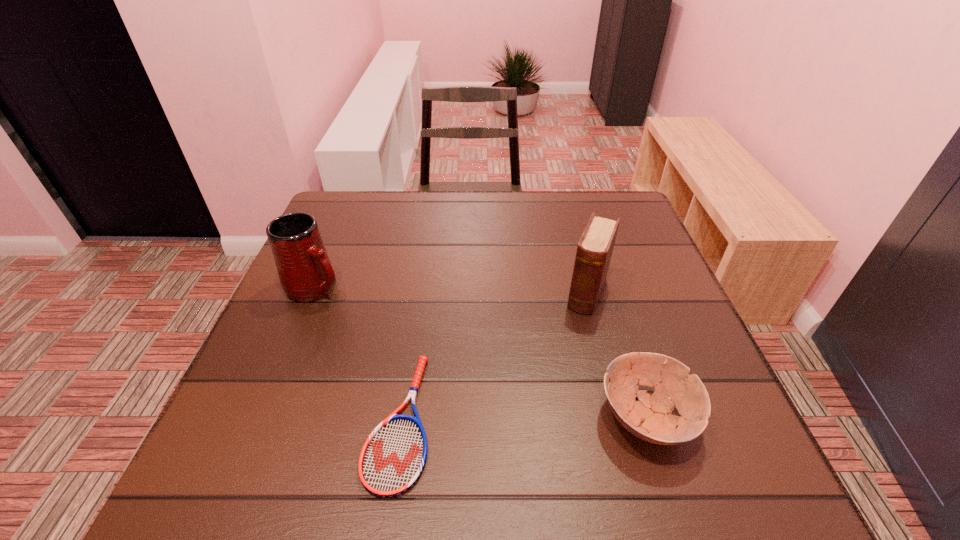
Image resolution: width=960 pixels, height=540 pixels. Find the location of `free space between the diary and the shortest object`. free space between the diary and the shortest object is located at coordinates (493, 357).

Image resolution: width=960 pixels, height=540 pixels. What are the coordinates of `empty space that is in between the second shortest object and the shortest object` in the screenshot? It's located at (522, 419).

Where is `free space that is in between the mug and the bowl`? free space that is in between the mug and the bowl is located at coordinates (481, 352).

Where is `free area in between the diary and the mug`? The width and height of the screenshot is (960, 540). free area in between the diary and the mug is located at coordinates (452, 290).

Identify the location of vacant area between the second object from left to right and the bowl. The width and height of the screenshot is (960, 540). (522, 419).

Locate an element on the screen. The width and height of the screenshot is (960, 540). object that is the third closest to the mug is located at coordinates (650, 418).

Point out which object is positioned as the third nearest to the mug. Please provide its 2D coordinates. Your answer should be formatted as a tuple, i.e. [(x, y)], where the tuple contains the x and y coordinates of a point satisfying the conditions above.

[(650, 418)]

Locate an element on the screen. free spot that satisfies the following two spatial constraints: 1. on the front side of the leftmost object; 2. on the right side of the tennis racket is located at coordinates (261, 421).

Locate an element on the screen. free spot that satisfies the following two spatial constraints: 1. on the front side of the bowl; 2. on the left side of the diary is located at coordinates (620, 417).

Identify the location of free space that satisfies the following two spatial constraints: 1. on the front side of the bowl; 2. on the left side of the diary. (620, 417).